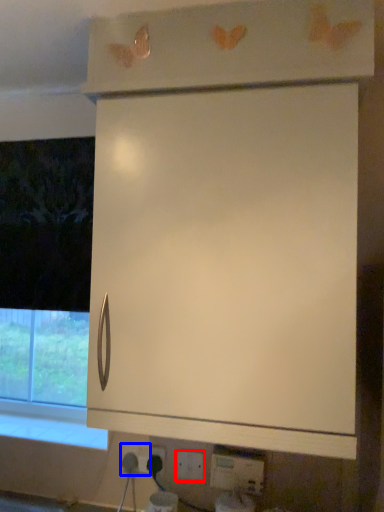
Question: Which object is further to the camera taking this photo, electric outlet (highlighted by a red box) or electric outlet (highlighted by a blue box)?

Choices:
 (A) electric outlet
 (B) electric outlet

Answer: (B)